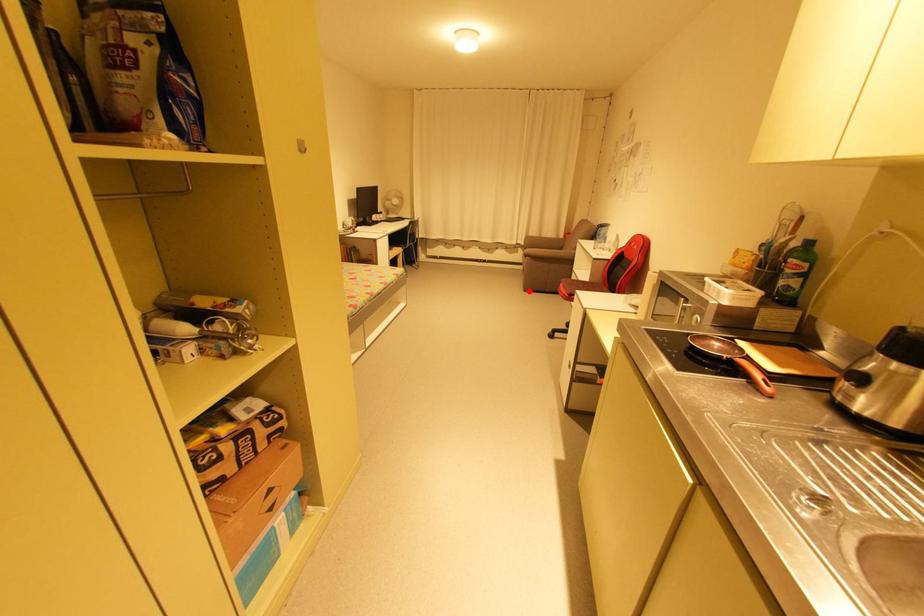
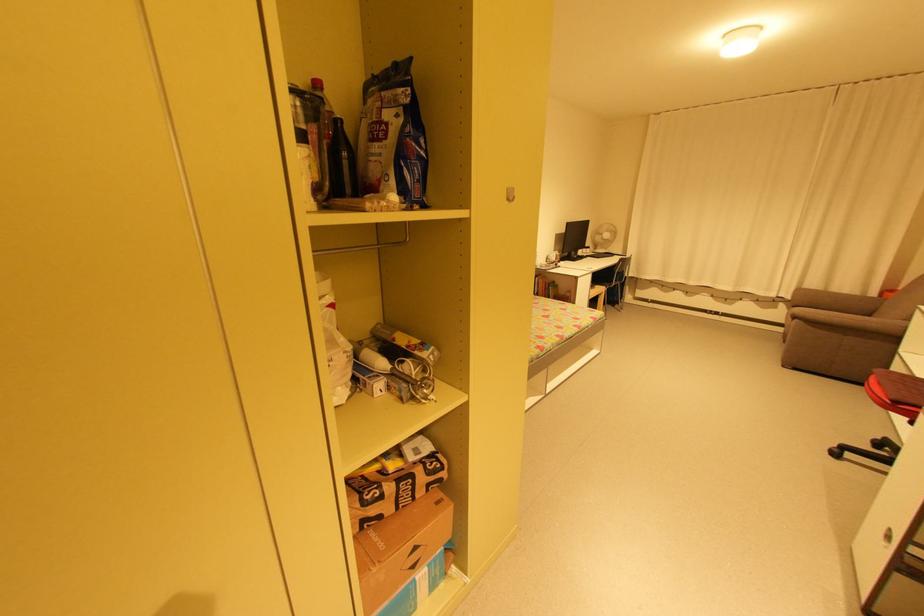
Question: I am providing you with two images of the same scene from different viewpoints. Image1 has a red point marked. In image2, the corresponding 3D location appears at what relative position? Reply with the corresponding letter.

Choices:
 (A) Closer
 (B) Farther

Answer: (B)